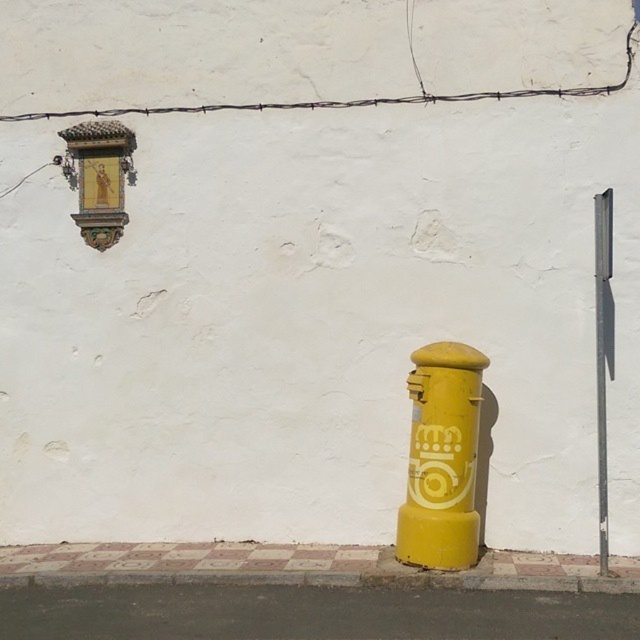
Between smooth asphalt pavement at lower center and yellow concrete curb at lower center, which one is positioned lower?

smooth asphalt pavement at lower center

Is smooth asphalt pavement at lower center taller than yellow concrete curb at lower center?

No.

What do you see at coordinates (310, 612) in the screenshot? This screenshot has width=640, height=640. I see `smooth asphalt pavement at lower center` at bounding box center [310, 612].

At what (x,y) coordinates should I click in order to perform the action: click on smooth asphalt pavement at lower center. Please return your answer as a coordinate pair (x, y). The image size is (640, 640). Looking at the image, I should click on (310, 612).

What do you see at coordinates (442, 458) in the screenshot? I see `yellow matte postbox at center` at bounding box center [442, 458].

This screenshot has width=640, height=640. Find the location of `yellow matte postbox at center`. yellow matte postbox at center is located at coordinates pyautogui.click(x=442, y=458).

Does point (97, 611) come farther from viewer compared to point (596, 337)?

No, it is not.

Image resolution: width=640 pixels, height=640 pixels. What do you see at coordinates (310, 612) in the screenshot? I see `smooth asphalt pavement at lower center` at bounding box center [310, 612].

Locate an element on the screen. The height and width of the screenshot is (640, 640). smooth asphalt pavement at lower center is located at coordinates (310, 612).